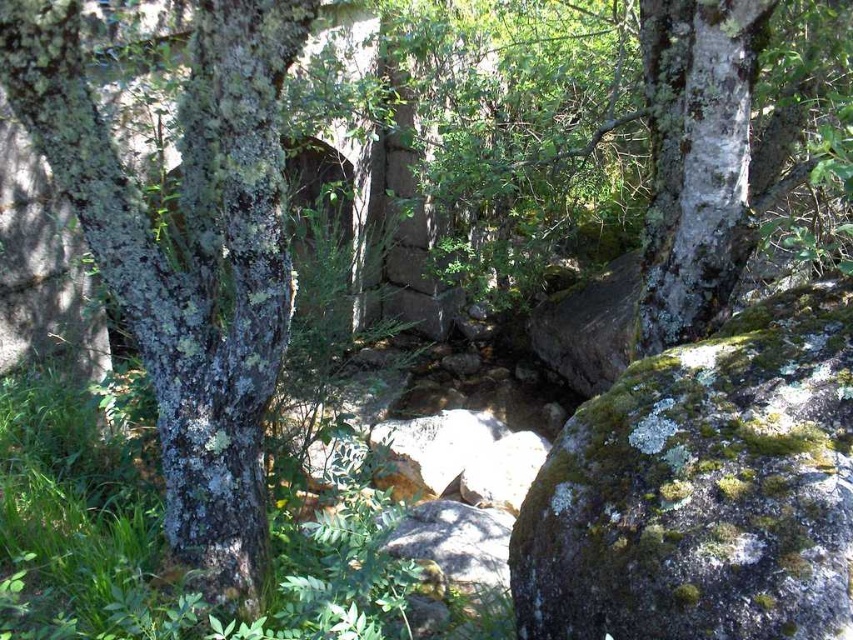
Question: Is green mossy rock at center bigger than speckled bark tree at center?

Choices:
 (A) yes
 (B) no

Answer: (B)

Question: Is green mossy rock at center further to the viewer compared to white lichen-covered tree trunk at right?

Choices:
 (A) no
 (B) yes

Answer: (A)

Question: Which point is closer to the camera taking this photo?

Choices:
 (A) (683, 26)
 (B) (715, 632)

Answer: (B)

Question: Does green mossy rock at center appear under speckled bark tree at center?

Choices:
 (A) no
 (B) yes

Answer: (B)

Question: Estimate the real-world distances between objects in this image. Which object is farther from the speckled bark tree at center?

Choices:
 (A) white lichen-covered tree trunk at right
 (B) green mossy rock at center

Answer: (A)

Question: Which point appears closest to the camera in this image?

Choices:
 (A) (651, 618)
 (B) (260, 566)
 (C) (712, 88)

Answer: (A)